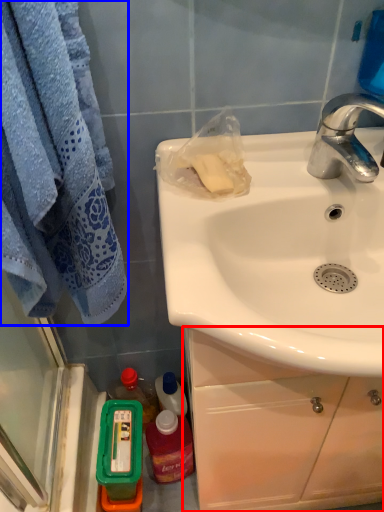
Question: Which of the following is the farthest to the observer, cabinetry (highlighted by a red box) or towel/napkin (highlighted by a blue box)?

Choices:
 (A) cabinetry
 (B) towel/napkin

Answer: (A)